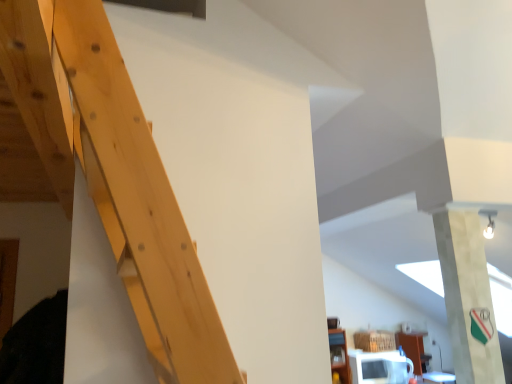
Question: Does white glossy microwave at lower right have a smaller size compared to white fabric banner at upper right?

Choices:
 (A) yes
 (B) no

Answer: (B)

Question: From the image's perspective, would you say white glossy microwave at lower right is shown under white fabric banner at upper right?

Choices:
 (A) yes
 (B) no

Answer: (A)

Question: Is white glossy microwave at lower right next to white fabric banner at upper right?

Choices:
 (A) yes
 (B) no

Answer: (B)

Question: From the image's perspective, is white glossy microwave at lower right above white fabric banner at upper right?

Choices:
 (A) yes
 (B) no

Answer: (B)

Question: Is white glossy microwave at lower right positioned with its back to white fabric banner at upper right?

Choices:
 (A) yes
 (B) no

Answer: (B)

Question: Does white glossy microwave at lower right have a lesser height compared to white fabric banner at upper right?

Choices:
 (A) no
 (B) yes

Answer: (B)

Question: Is white fabric banner at upper right aimed at white glossy microwave at lower right?

Choices:
 (A) yes
 (B) no

Answer: (B)

Question: Is the depth of white fabric banner at upper right less than that of white glossy microwave at lower right?

Choices:
 (A) no
 (B) yes

Answer: (B)

Question: Does white fabric banner at upper right contain white glossy microwave at lower right?

Choices:
 (A) no
 (B) yes

Answer: (A)

Question: Can you confirm if white fabric banner at upper right is wider than white glossy microwave at lower right?

Choices:
 (A) no
 (B) yes

Answer: (A)

Question: Does white fabric banner at upper right have a greater height compared to white glossy microwave at lower right?

Choices:
 (A) no
 (B) yes

Answer: (B)

Question: From a real-world perspective, is white fabric banner at upper right on top of white glossy microwave at lower right?

Choices:
 (A) yes
 (B) no

Answer: (A)

Question: From a real-world perspective, is white glossy microwave at lower right physically located above or below white fabric banner at upper right?

Choices:
 (A) below
 (B) above

Answer: (A)